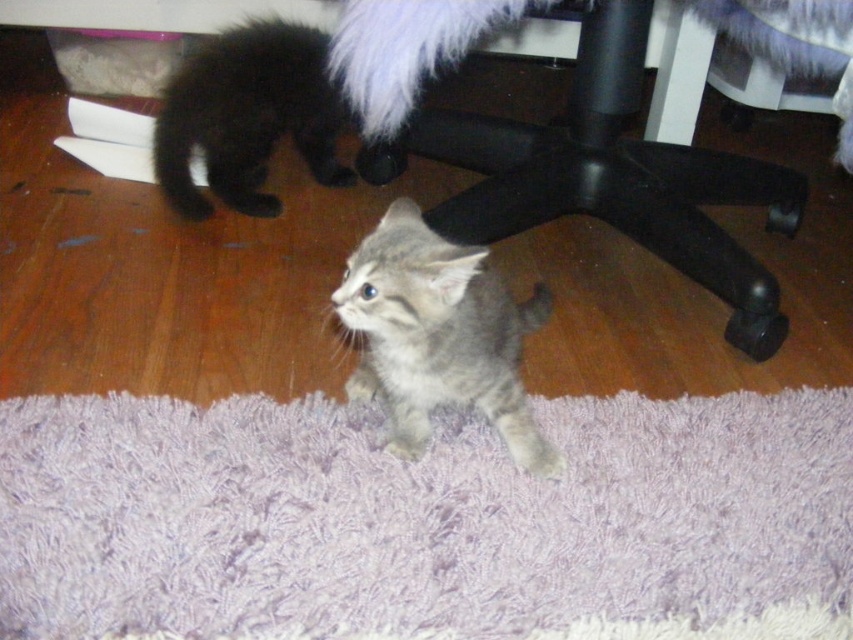
You are standing in a room with two kittens and a black plastic computer chair at lower center. You want to place a small toy exactly at point (x=608, y=177). Which object is located at that coordinate?

The black plastic computer chair at lower center is located at point (x=608, y=177).

From the picture: You are a small robot with a diameter of 12 inches. You are positioned on the purple shaggy rug at center and want to reach the black plastic computer chair at lower center. Can you move directly to the chair without encountering any obstacles?

The distance between the purple shaggy rug at center and the black plastic computer chair at lower center is 19.37 inches. Since your diameter is 12 inches, you can move directly to the chair without any issues as the distance is sufficient.

You are a cat owner who wants to place a 10 cm tall toy mouse on the floor near the black plastic computer chair at lower center. Based on the coordinates provided, where should you place the toy mouse to ensure it is closest to the chair?

The black plastic computer chair at lower center is located at point (608, 177). To place the toy mouse closest to the chair, position it near those coordinates.